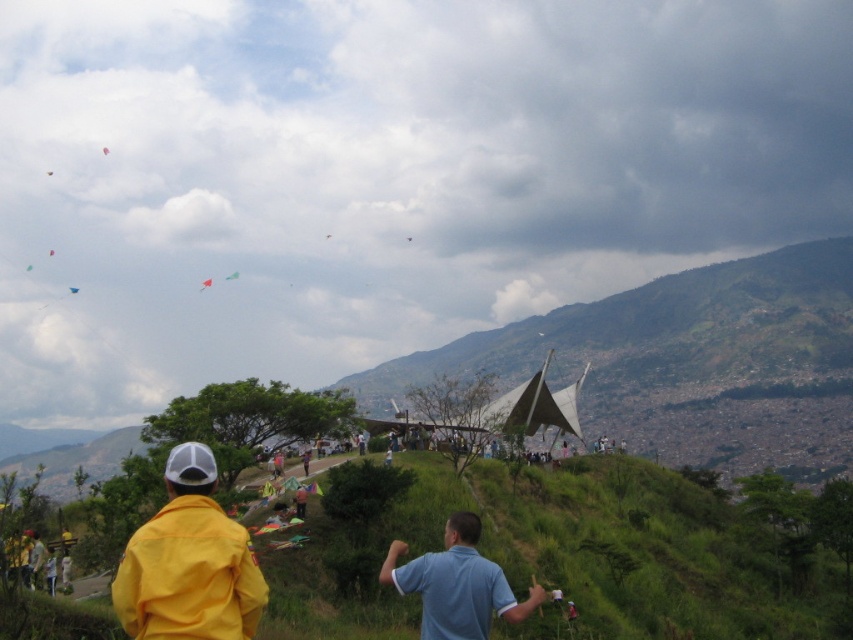
Question: Which object is farther from the camera taking this photo?

Choices:
 (A) yellow matte jacket at lower left
 (B) translucent purple kite at upper center

Answer: (B)

Question: Does green grassy hillside at center have a larger size compared to translucent purple kite at upper center?

Choices:
 (A) yes
 (B) no

Answer: (A)

Question: Among these objects, which one is farthest from the camera?

Choices:
 (A) yellow matte jacket at lower left
 (B) translucent purple kite at upper center

Answer: (B)

Question: Is light blue cotton shirt at center to the right of translucent purple kite at upper center from the viewer's perspective?

Choices:
 (A) no
 (B) yes

Answer: (B)

Question: Does matte pink kite at upper left have a smaller size compared to translucent green kite at upper left?

Choices:
 (A) no
 (B) yes

Answer: (B)

Question: Among these points, which one is farthest from the camera?

Choices:
 (A) (74, 291)
 (B) (51, 250)
 (C) (253, 627)
 (D) (567, 524)

Answer: (B)